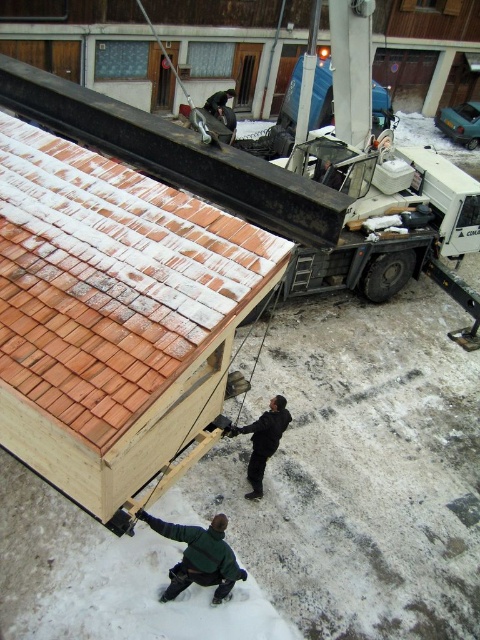
You are an inspector checking the crane operation. You notice the brown shingles at upper left and the green matte jacket at lower center in your line of sight. Which object would block your view of the other if they were aligned along the same line of sight?

The brown shingles at upper left would block the view of the green matte jacket at lower center because it is larger in size.

Based on the photo, you are standing in the snowy area and want to move from the brown shingles at upper left to the black matte jacket at center. Which direction should you move to get closer to the jacket?

To move closer to the black matte jacket at center from the brown shingles at upper left, you should move to the right since the brown shingles at upper left is located to the left of the jacket.

Looking at this image, you are standing at the point labeled as point (x=205, y=547) in the image. A snowplow needs to reach you from the crane located on the right side of the image. The snowplow can travel 6 meters on snow. Can the snowplow reach you?

The distance between point (x=205, y=547) and the viewer is 6.55 meters. Since the snowplow can only travel 6 meters on snow, it cannot reach you.